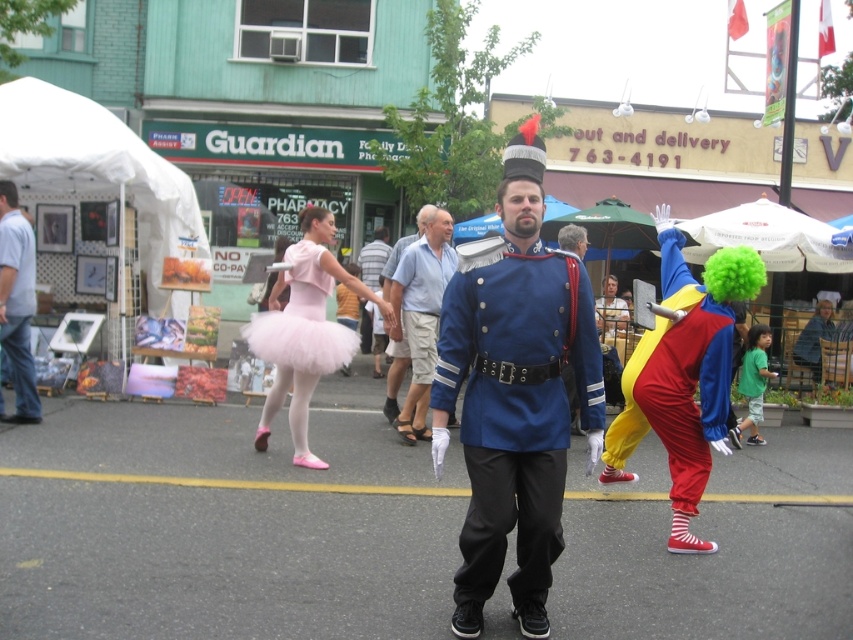
You are a photographer at the festival and want to capture a photo that includes both the shiny blue uniform at center and the matte pink tutu at center. Based on their positions, which one should you adjust your camera angle to focus on first to ensure both are in frame?

Result: The shiny blue uniform at center is located below the matte pink tutu at center. To capture both in the frame, adjust your camera angle to focus on the shiny blue uniform at center first, as it is lower, then ensure the matte pink tutu at center is visible above it.

Looking at this image, you are a photographer trying to capture the best shot of the street scene. You notice two points marked at coordinates point (314, 248) and point (379, 371). Which point is closer to the camera based on their positions?

Point (314, 248) is in front of point (379, 371), so it is closer to the camera.